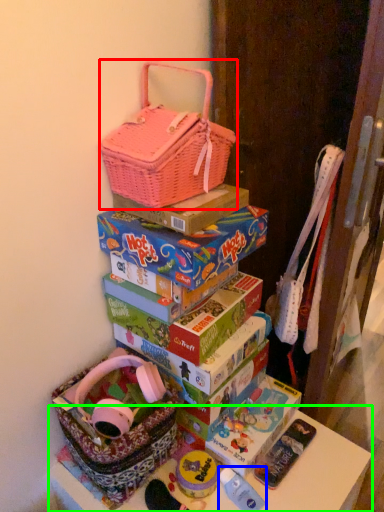
Question: Based on their relative distances, which object is farther from handbag (highlighted by a red box)? Choose from toy (highlighted by a blue box) and table (highlighted by a green box).

Choices:
 (A) toy
 (B) table

Answer: (A)